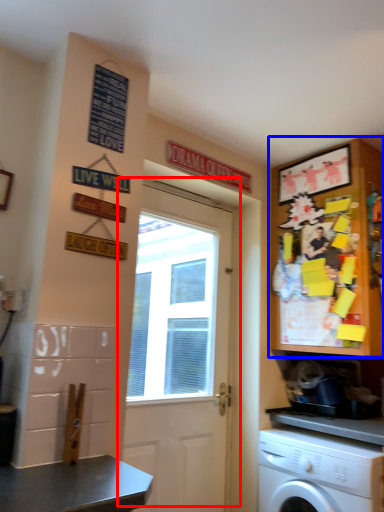
Question: Which of the following is the farthest to the observer, door (highlighted by a red box) or cabinetry (highlighted by a blue box)?

Choices:
 (A) door
 (B) cabinetry

Answer: (B)